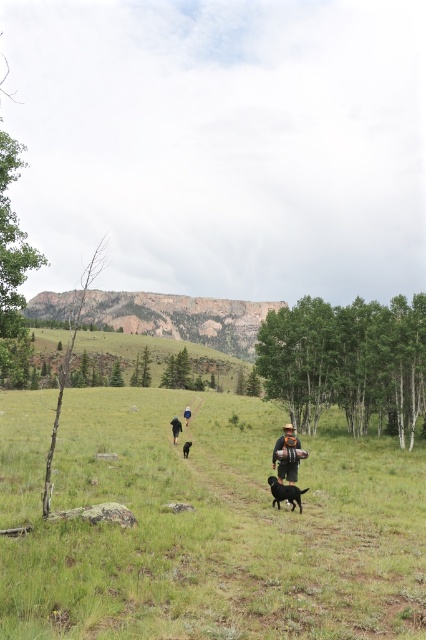
Is dark gray jacket at center further to the viewer compared to black fur dog at center?

No, dark gray jacket at center is in front of black fur dog at center.

Can you confirm if dark gray jacket at center is positioned below black fur dog at center?

No, dark gray jacket at center is not below black fur dog at center.

Where is `dark gray jacket at center`? The height and width of the screenshot is (640, 426). dark gray jacket at center is located at coordinates (287, 456).

Can you confirm if dark gray jacket at center is positioned to the left of black furry dog at center?

Incorrect, dark gray jacket at center is not on the left side of black furry dog at center.

Locate an element on the screen. dark gray jacket at center is located at coordinates (287, 456).

Where is `dark gray jacket at center`? The image size is (426, 640). dark gray jacket at center is located at coordinates (287, 456).

Between black furry dog at center and black fabric backpack at center, which one has less height?

With less height is black fabric backpack at center.

Between black furry dog at center and black fabric backpack at center, which one appears on the left side from the viewer's perspective?

From the viewer's perspective, black fabric backpack at center appears more on the left side.

Describe the element at coordinates (284, 492) in the screenshot. I see `black furry dog at center` at that location.

This screenshot has height=640, width=426. Find the location of `black furry dog at center`. black furry dog at center is located at coordinates (284, 492).